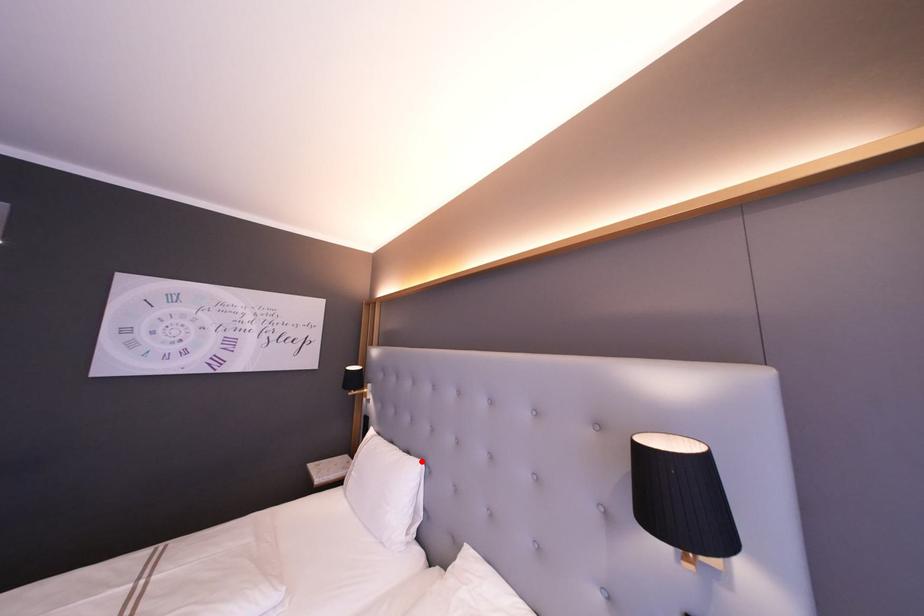
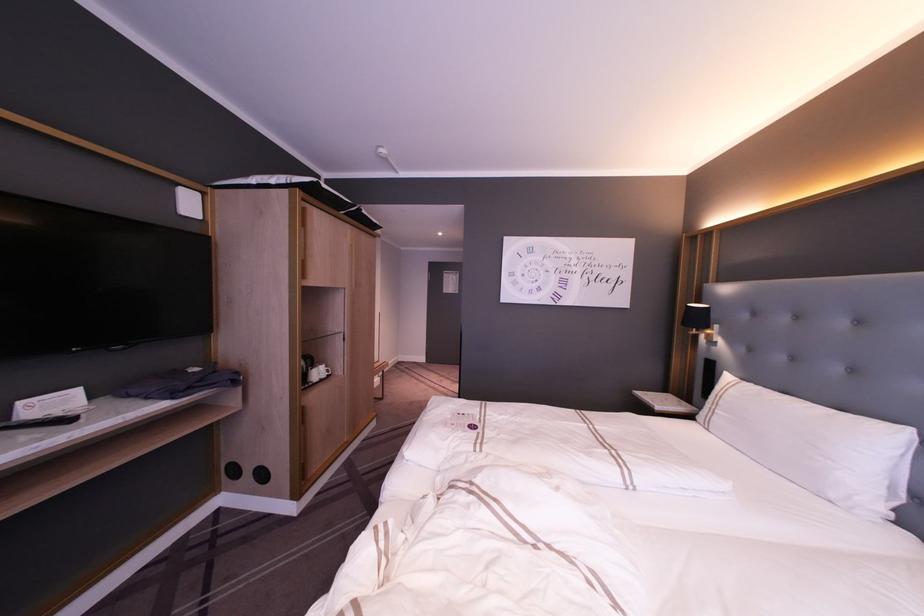
The point at the highlighted location is marked in the first image. Where is the corresponding point in the second image?

(910, 429)